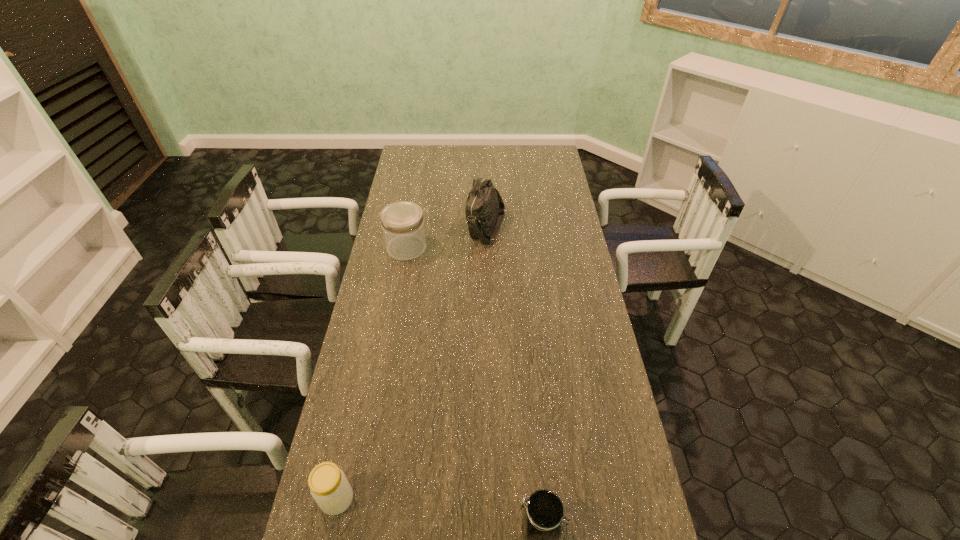
Locate an element on the screen. The width and height of the screenshot is (960, 540). the tallest object is located at coordinates (485, 210).

The width and height of the screenshot is (960, 540). Identify the location of the farthest jar. (402, 222).

Locate an element on the screen. This screenshot has height=540, width=960. free space located 0.150m at the front padded panel of the shoulder bag is located at coordinates (430, 227).

The width and height of the screenshot is (960, 540). What are the coordinates of `vacant position located 0.290m at the front padded panel of the shoulder bag` in the screenshot? It's located at (396, 227).

I want to click on blank space located 0.080m at the front padded panel of the shoulder bag, so click(447, 227).

Where is `free space located on the back of the farthest jar`? The width and height of the screenshot is (960, 540). free space located on the back of the farthest jar is located at coordinates (414, 207).

The image size is (960, 540). Identify the location of vacant area at the far edge of the desktop. (454, 163).

At what (x,y) coordinates should I click in order to perform the action: click on free space at the left edge. Please return your answer as a coordinate pair (x, y). Image resolution: width=960 pixels, height=540 pixels. Looking at the image, I should click on (430, 172).

Where is `free space at the right edge of the desktop`? Image resolution: width=960 pixels, height=540 pixels. free space at the right edge of the desktop is located at coordinates (554, 212).

The image size is (960, 540). What are the coordinates of `free space at the far left corner of the desktop` in the screenshot? It's located at (404, 161).